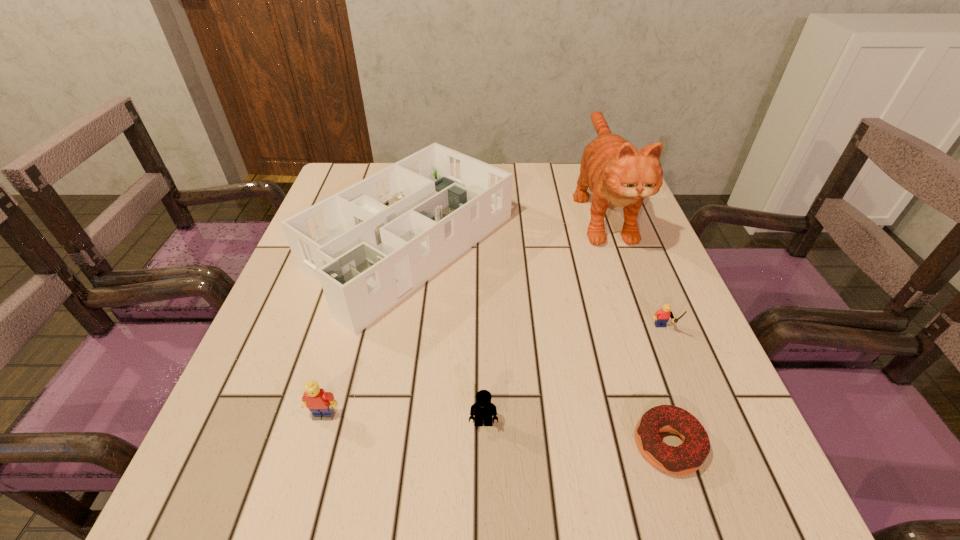
Where is `unoccupied position between the fifth shortest object and the rightmost Lego`? This screenshot has height=540, width=960. unoccupied position between the fifth shortest object and the rightmost Lego is located at coordinates (537, 288).

This screenshot has height=540, width=960. In order to click on free space between the second tallest object and the second Lego from right to left in this screenshot , I will do `click(446, 334)`.

At what (x,y) coordinates should I click in order to perform the action: click on vacant area that lies between the farthest Lego and the second Lego from left to right. Please return your answer as a coordinate pair (x, y). The height and width of the screenshot is (540, 960). Looking at the image, I should click on tap(573, 377).

This screenshot has width=960, height=540. In order to click on vacant point located between the doughnut and the cat in this screenshot , I will do `click(635, 327)`.

You are a GUI agent. You are given a task and a screenshot of the screen. Output one action in this format:
    pyautogui.click(x=<x>, y=<y>)
    Task: Click on the free area in between the leftmost Lego and the shortest object
    
    Given the screenshot: What is the action you would take?
    pyautogui.click(x=496, y=430)

Image resolution: width=960 pixels, height=540 pixels. I want to click on empty location between the second Lego from left to right and the tallest object, so click(542, 315).

Where is `vacant space that's between the dollhouse and the cat`? This screenshot has height=540, width=960. vacant space that's between the dollhouse and the cat is located at coordinates (506, 227).

Select which object appears as the closest to the leftmost Lego. Please provide its 2D coordinates. Your answer should be formatted as a tuple, i.e. [(x, y)], where the tuple contains the x and y coordinates of a point satisfying the conditions above.

[(372, 244)]

Select which object appears as the fourth closest to the shortest object. Please provide its 2D coordinates. Your answer should be formatted as a tuple, i.e. [(x, y)], where the tuple contains the x and y coordinates of a point satisfying the conditions above.

[(617, 174)]

At what (x,y) coordinates should I click in order to perform the action: click on Lego that stands as the closest to the second tallest object. Please return your answer as a coordinate pair (x, y). Looking at the image, I should click on (320, 403).